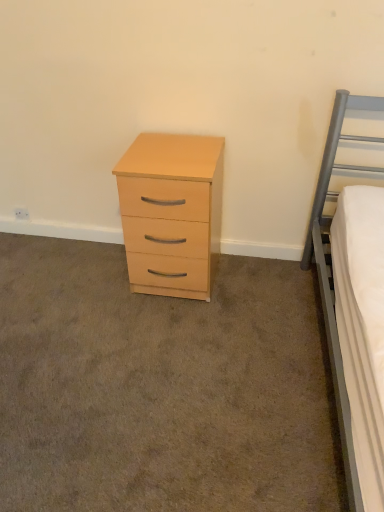
Where is `vacant area on top of light wood drawer at center (from a real-world perspective)`? The height and width of the screenshot is (512, 384). vacant area on top of light wood drawer at center (from a real-world perspective) is located at coordinates (124, 338).